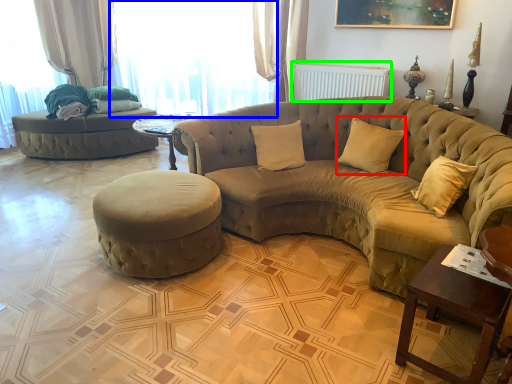
Question: Which object is the closest to the pillow (highlighted by a red box)? Choose among these: window (highlighted by a blue box) or radiator (highlighted by a green box).

Choices:
 (A) window
 (B) radiator

Answer: (B)